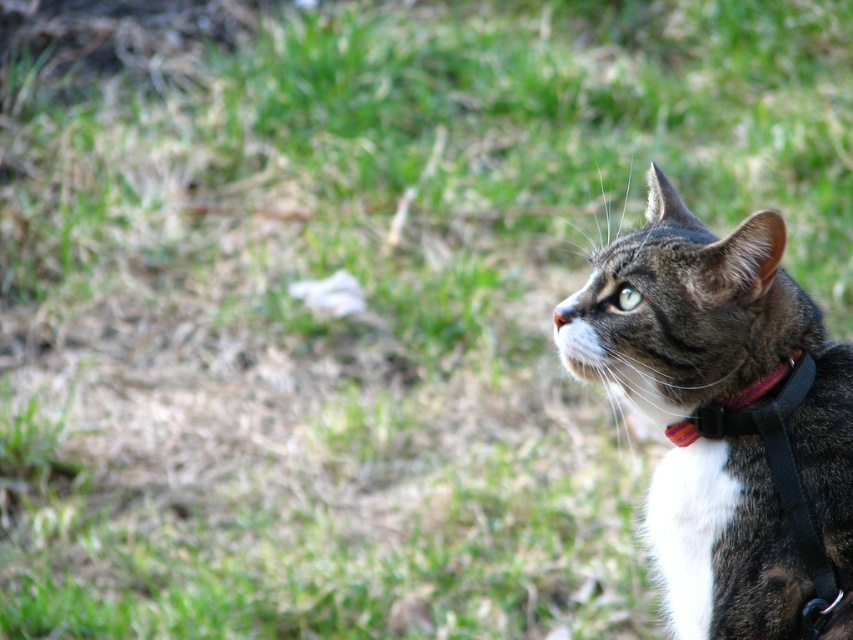
You are a photographer trying to focus on the tabby fur cat at right and the multicolored fabric collar at right in the image. Which object should you adjust your camera focus on first if you want to ensure the closest object is sharp?

The tabby fur cat at right is closer to the viewer than the multicolored fabric collar at right, so you should focus on the tabby fur cat at right first to ensure it is sharp.

You are a photographer trying to capture a close up of the tabby fur cat at right. You are currently standing at point [727,419]. Can you take the photo without moving from your current position?

Yes, because the tabby fur cat at right is located at point [727,419], which is your current position.